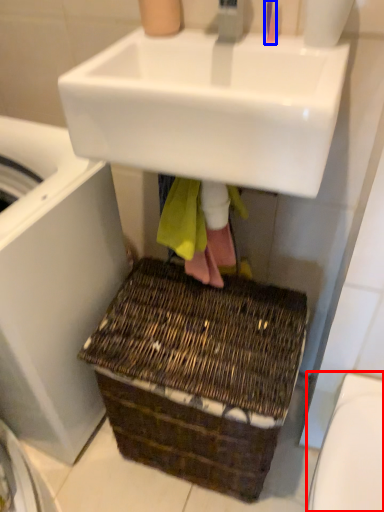
Question: Which object is further to the camera taking this photo, toilet bowl (highlighted by a red box) or toothbrush (highlighted by a blue box)?

Choices:
 (A) toilet bowl
 (B) toothbrush

Answer: (B)